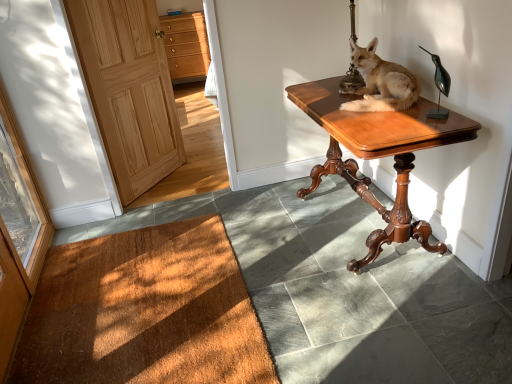
Question: From a real-world perspective, is light brown fur at center physically below brown textured mat at lower left?

Choices:
 (A) no
 (B) yes

Answer: (A)

Question: Is light brown fur at center oriented away from brown textured mat at lower left?

Choices:
 (A) yes
 (B) no

Answer: (B)

Question: Is light brown fur at center behind brown textured mat at lower left?

Choices:
 (A) no
 (B) yes

Answer: (B)

Question: Is light brown fur at center taller than brown textured mat at lower left?

Choices:
 (A) no
 (B) yes

Answer: (B)

Question: Is light brown fur at center to the right of brown textured mat at lower left from the viewer's perspective?

Choices:
 (A) no
 (B) yes

Answer: (B)

Question: Is transparent glass door at left to the left or to the right of brown textured mat at lower left in the image?

Choices:
 (A) left
 (B) right

Answer: (A)

Question: Is transparent glass door at left wider or thinner than brown textured mat at lower left?

Choices:
 (A) wide
 (B) thin

Answer: (B)

Question: Would you say transparent glass door at left is inside or outside brown textured mat at lower left?

Choices:
 (A) inside
 (B) outside

Answer: (B)

Question: Is transparent glass door at left bigger or smaller than brown textured mat at lower left?

Choices:
 (A) small
 (B) big

Answer: (B)

Question: Considering the relative positions of light brown wood door at left and transparent glass door at left in the image provided, is light brown wood door at left to the left or to the right of transparent glass door at left?

Choices:
 (A) left
 (B) right

Answer: (B)

Question: Is light brown wood door at left in front of or behind transparent glass door at left in the image?

Choices:
 (A) front
 (B) behind

Answer: (B)

Question: In terms of height, does light brown wood door at left look taller or shorter compared to transparent glass door at left?

Choices:
 (A) short
 (B) tall

Answer: (B)

Question: From the image's perspective, is light brown wood door at left located above or below transparent glass door at left?

Choices:
 (A) below
 (B) above

Answer: (B)

Question: In terms of width, does bronze metallic bird at upper right look wider or thinner when compared to mahogany wood desk at center?

Choices:
 (A) thin
 (B) wide

Answer: (A)

Question: From a real-world perspective, is bronze metallic bird at upper right positioned above or below mahogany wood desk at center?

Choices:
 (A) below
 (B) above

Answer: (B)